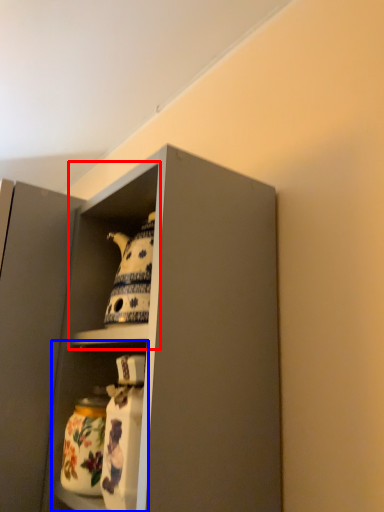
Question: Which object is closer to the camera taking this photo, cabinet (highlighted by a red box) or shelf (highlighted by a blue box)?

Choices:
 (A) cabinet
 (B) shelf

Answer: (A)